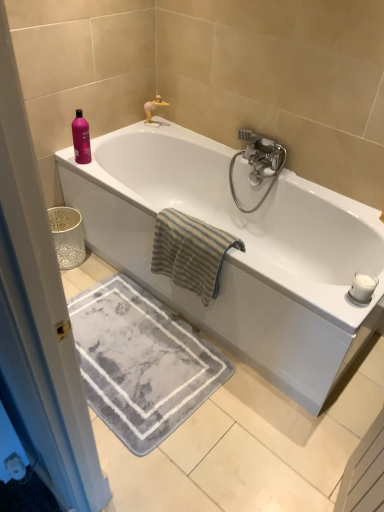
This screenshot has height=512, width=384. I want to click on spots to the right of silver metallic faucet at upper center, so click(188, 131).